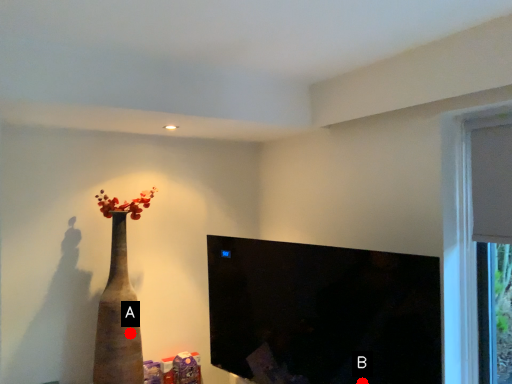
Question: Two points are circled on the image, labeled by A and B beside each circle. Which point appears closest to the camera in this image?

Choices:
 (A) A is closer
 (B) B is closer

Answer: (A)